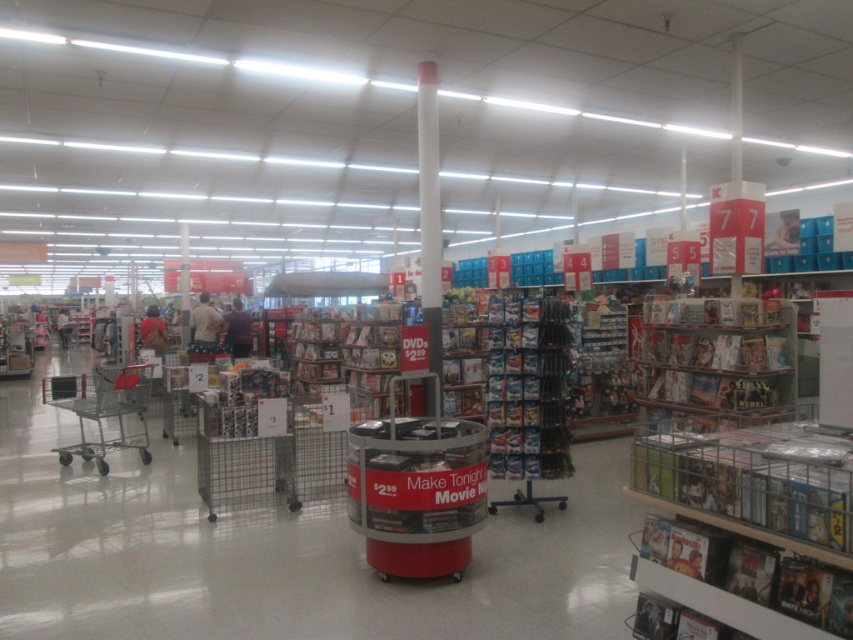
You are a store employee who needs to place a new promotional stand in the store. The stand requires a space of 1 meter in diameter. Considering the metallic silver shopping cart at center is currently at point 0.764, 0.489, can you place the stand in the center of the store without moving the shopping cart?

The metallic silver shopping cart at center is located at point (x=416, y=488), so placing the promotional stand at the center of the store would not interfere with the shopping cart as long as the distance between them is sufficient to accommodate the stand. However, without specific spatial dimensions of the store, it is impossible to confirm if the stand can be placed there without moving the cart.

You are a store employee who needs to place a new promotional stand that is 3 feet tall. The store requires that the stand must not block the main aisle. Given the metallic silver shopping cart at center and the silver metallic shopping cart at left, which cart should you position the stand next to so it doesn

The metallic silver shopping cart at center is taller than the silver metallic shopping cart at left. Since the promotional stand is 3 feet tall, positioning it next to the shorter silver metallic shopping cart at left would ensure the stand doesn

You are a customer in the store looking for a DVD. You see the metallic silver shelves at right and the silver metallic shopping cart at left. Which object is taller?

The metallic silver shelves at right are much taller than the silver metallic shopping cart at left according to the description.